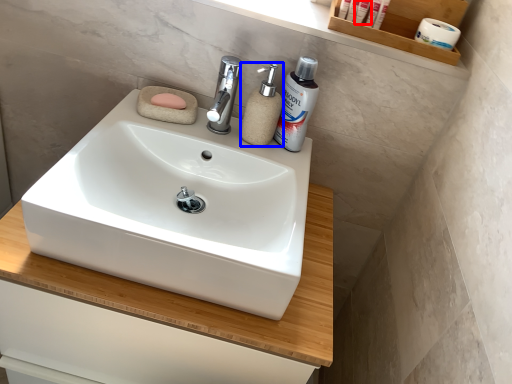
Question: Which object appears farthest to the camera in this image, personal care (highlighted by a red box) or soap dispenser (highlighted by a blue box)?

Choices:
 (A) personal care
 (B) soap dispenser

Answer: (A)